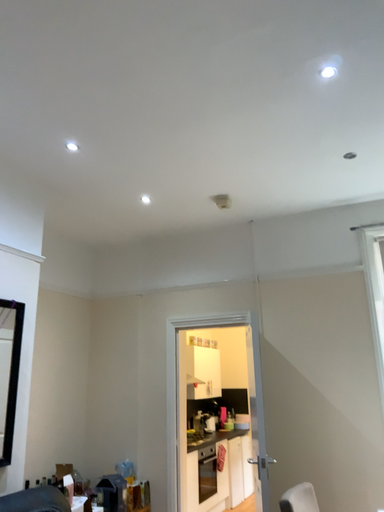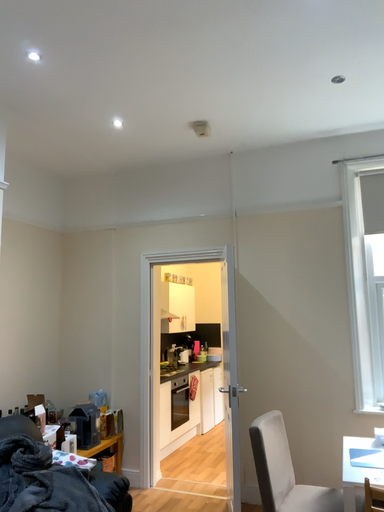
Question: How did the camera likely rotate when shooting the video?

Choices:
 (A) rotated upward
 (B) rotated downward

Answer: (B)